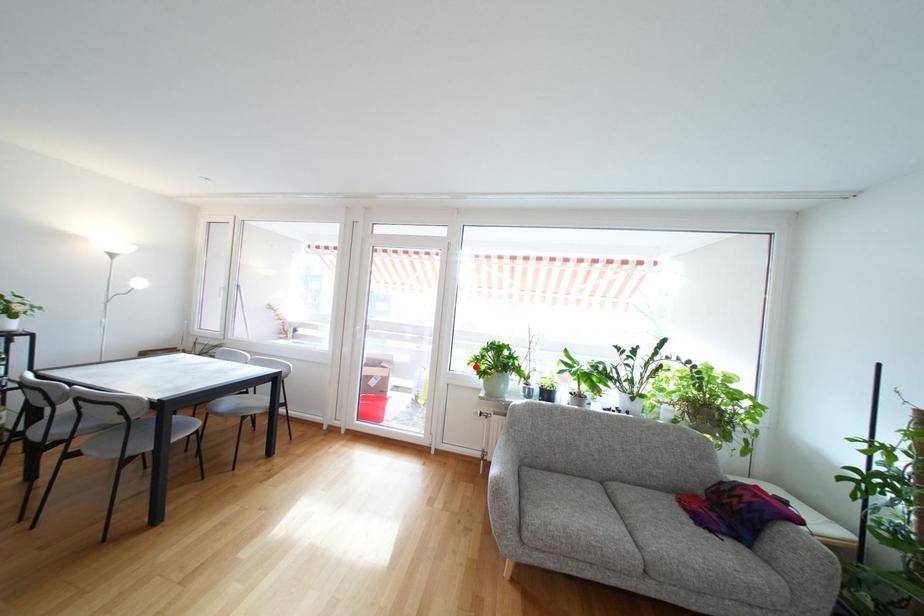
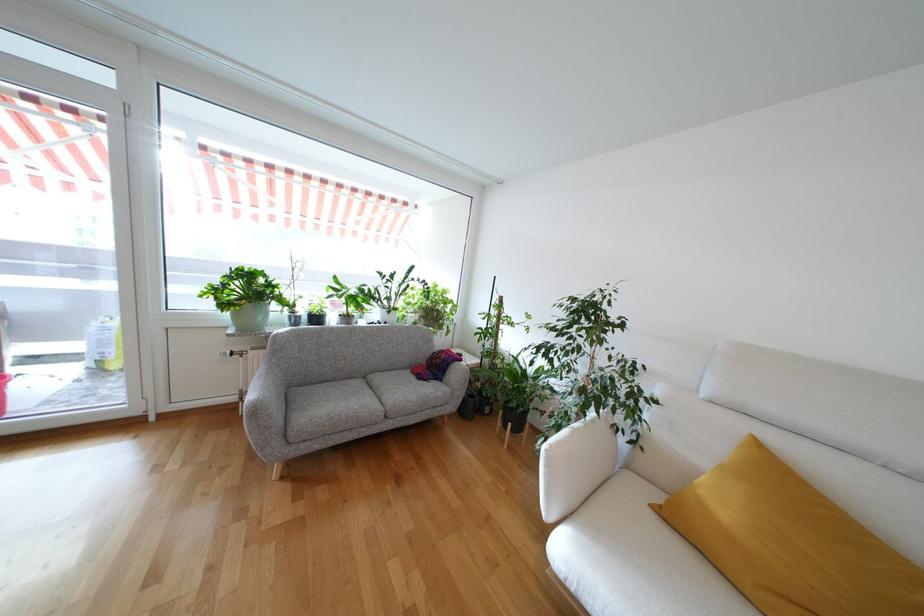
Locate, in the second image, the point that corresponds to the highlighted location in the first image.

(212, 300)